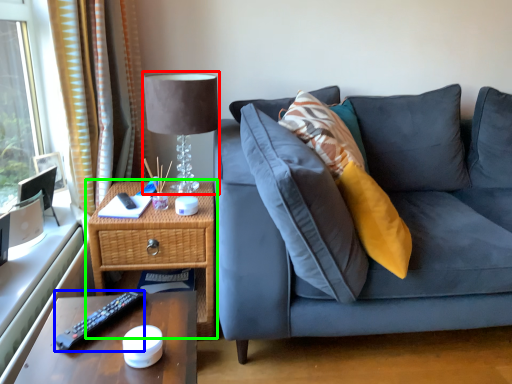
Question: Which is farther away from table lamp (highlighted by a red box)? remote (highlighted by a blue box) or nightstand (highlighted by a green box)?

Choices:
 (A) remote
 (B) nightstand

Answer: (A)